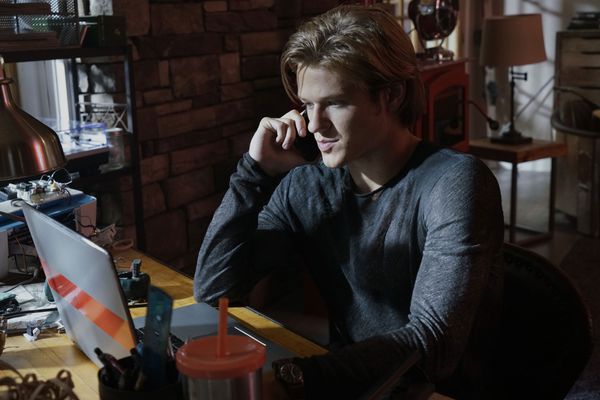
The width and height of the screenshot is (600, 400). What are the coordinates of `laptop` in the screenshot? It's located at (113, 294).